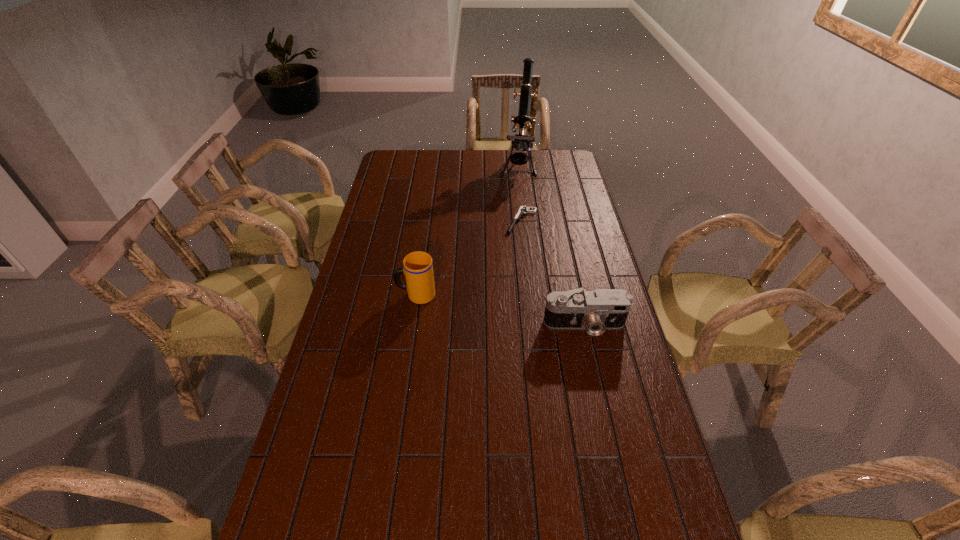
At what (x,y) coordinates should I click in order to perform the action: click on vacant area at the left edge. Please return your answer as a coordinate pair (x, y). The image size is (960, 540). Looking at the image, I should click on (359, 271).

The width and height of the screenshot is (960, 540). Find the location of `vacant space at the right edge of the desktop`. vacant space at the right edge of the desktop is located at coordinates (612, 369).

The width and height of the screenshot is (960, 540). In order to click on vacant space at the far left corner of the desktop in this screenshot , I will do `click(393, 156)`.

Image resolution: width=960 pixels, height=540 pixels. I want to click on vacant space at the far right corner of the desktop, so click(x=573, y=174).

I want to click on vacant region between the third nearest object and the cup, so click(x=468, y=258).

Locate an element on the screen. The image size is (960, 540). empty location between the farthest object and the second tallest object is located at coordinates (467, 231).

Identify the location of vacant space in between the third nearest object and the second shortest object. This screenshot has height=540, width=960. (553, 273).

Find the location of a particular element. Image resolution: width=960 pixels, height=540 pixels. vacant area between the shortest object and the camera is located at coordinates (553, 273).

This screenshot has height=540, width=960. Identify the location of unoccupied area between the third farthest object and the shortest object. pos(468,258).

Where is `empty location between the camera and the cup`? empty location between the camera and the cup is located at coordinates (500, 310).